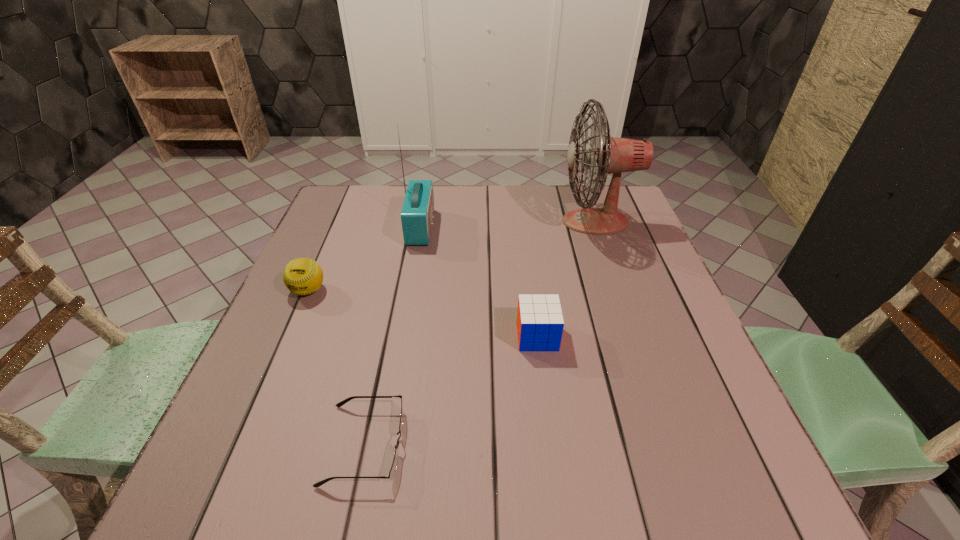
Identify the location of free area in between the softball and the fourth shortest object. The height and width of the screenshot is (540, 960). (365, 259).

The width and height of the screenshot is (960, 540). I want to click on free space that is in between the second object from right to left and the rightmost object, so click(x=566, y=279).

Where is `empty space between the radio receiver and the nearest object`? This screenshot has height=540, width=960. empty space between the radio receiver and the nearest object is located at coordinates (393, 336).

The image size is (960, 540). In order to click on vacant space that's between the fourth farthest object and the fan in this screenshot , I will do `click(566, 279)`.

Identify the location of free space between the spectacles and the fourth farthest object. coord(451,390).

You are a GUI agent. You are given a task and a screenshot of the screen. Output one action in this format:
    pyautogui.click(x=<x>, y=<y>)
    Task: Click on the unoccupied position between the rightmost object and the cube
    
    Given the screenshot: What is the action you would take?
    pyautogui.click(x=566, y=279)

The image size is (960, 540). What are the coordinates of `unoccupied area between the spectacles and the tallest object` in the screenshot? It's located at (480, 333).

Identify which object is the closest to the fourth object from left to right. Please provide its 2D coordinates. Your answer should be formatted as a tuple, i.e. [(x, y)], where the tuple contains the x and y coordinates of a point satisfying the conditions above.

[(393, 469)]

Identify the location of object that is the third closest to the leftmost object. (540, 323).

You are a GUI agent. You are given a task and a screenshot of the screen. Output one action in this format:
    pyautogui.click(x=<x>, y=<y>)
    Task: Click on the vacant space that satisfies the following two spatial constraints: 1. on the front panel of the cube; 2. on the right side of the fourth shortest object
    This screenshot has height=540, width=960.
    Given the screenshot: What is the action you would take?
    pyautogui.click(x=401, y=336)